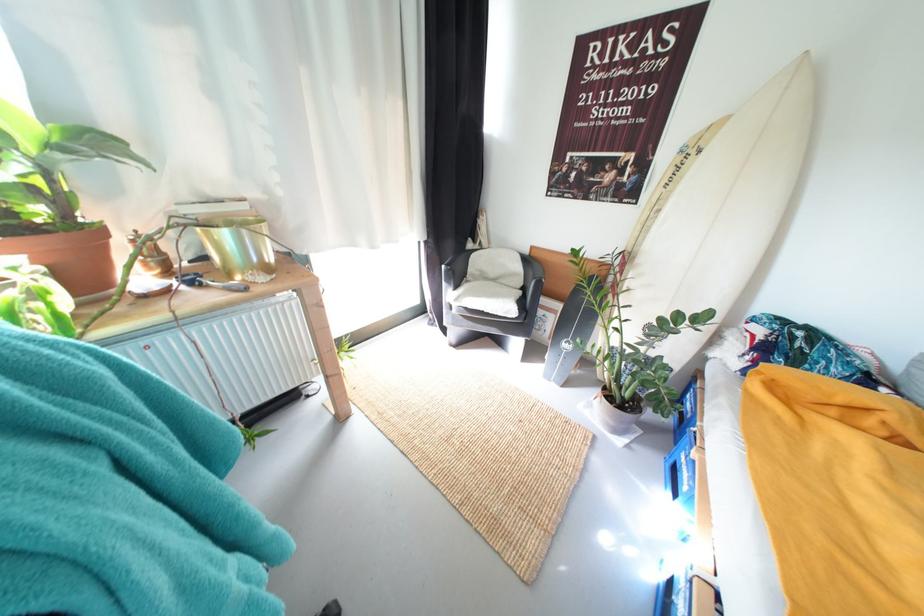
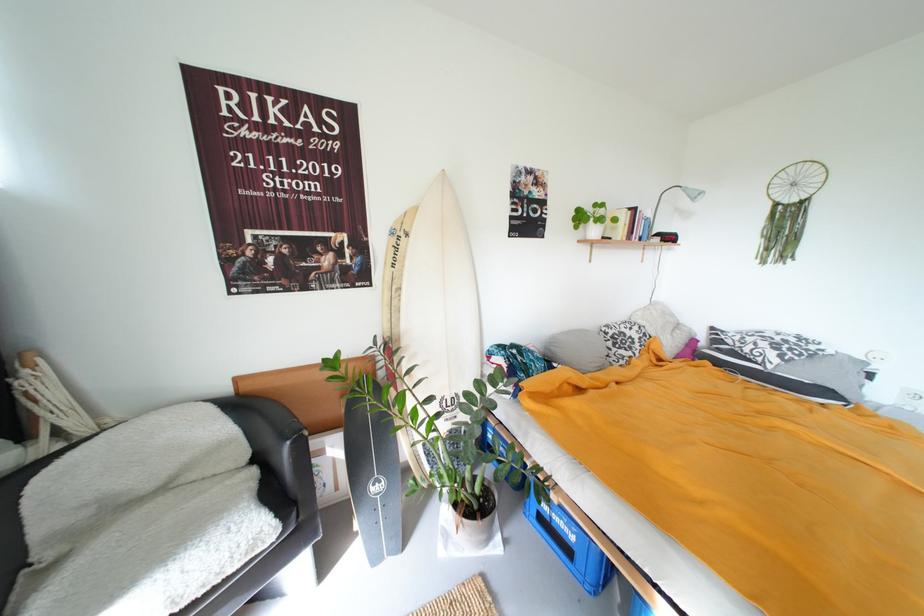
The point at [679,463] is marked in the first image. Where is the corresponding point in the second image?

(542, 517)